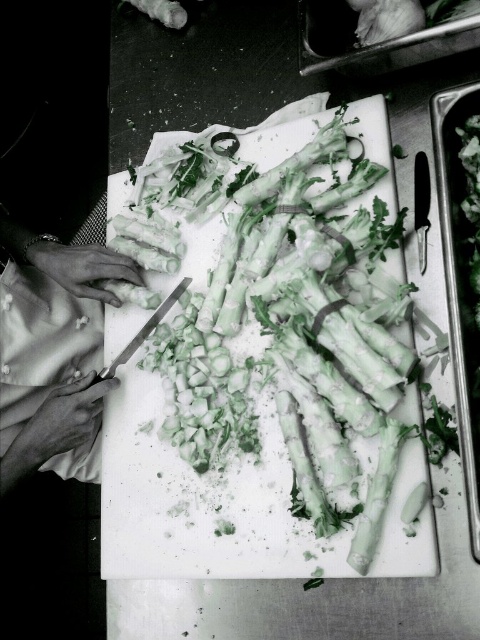
Question: Is smooth white hands at lower left to the left of silver metallic knife at center-left from the viewer's perspective?

Choices:
 (A) yes
 (B) no

Answer: (A)

Question: Among these objects, which one is nearest to the camera?

Choices:
 (A) smooth white hands at lower left
 (B) white matte onion at upper right
 (C) white plastic cutting board at center
 (D) silver metallic knife at center-left

Answer: (C)

Question: Is white plastic cutting board at center closer to the viewer compared to smooth white hands at lower left?

Choices:
 (A) yes
 (B) no

Answer: (A)

Question: Considering the relative positions of white plastic cutting board at center and silver metallic knife at center-left in the image provided, where is white plastic cutting board at center located with respect to silver metallic knife at center-left?

Choices:
 (A) right
 (B) left

Answer: (A)

Question: Which of the following is the closest to the observer?

Choices:
 (A) (385, 38)
 (B) (144, 326)

Answer: (A)

Question: Which of the following is the closest to the observer?

Choices:
 (A) white plastic cutting board at center
 (B) white matte onion at upper right
 (C) smooth white hands at lower left

Answer: (A)